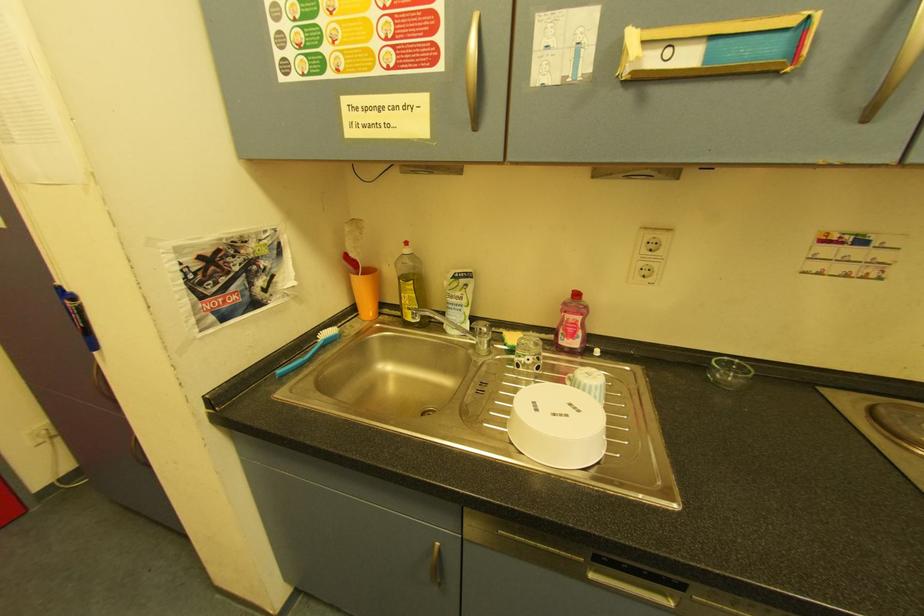
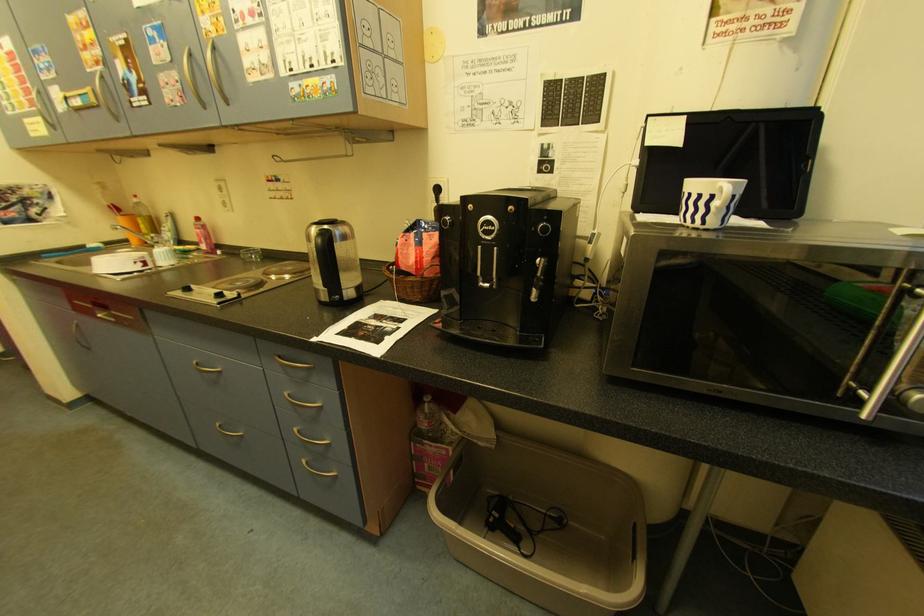
Question: What movement of the cameraman would produce the second image?

Choices:
 (A) Left
 (B) Right
 (C) Forward
 (D) Backward

Answer: (B)